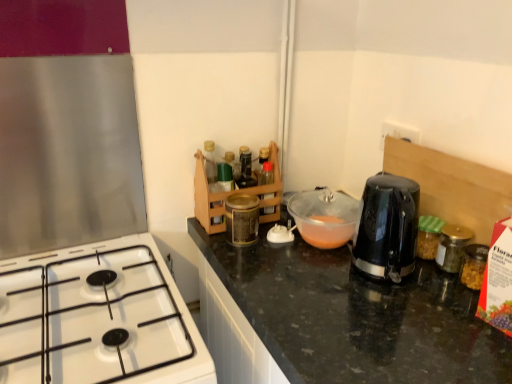
The height and width of the screenshot is (384, 512). Describe the element at coordinates (324, 217) in the screenshot. I see `translucent plastic bowl at center` at that location.

At what (x,y) coordinates should I click in order to perform the action: click on translucent plastic bowl at center. Please return your answer as a coordinate pair (x, y). This screenshot has width=512, height=384. Looking at the image, I should click on (324, 217).

Which object is closer to the camera taking this photo, gold metallic jar at right or translucent plastic bowl at center?

gold metallic jar at right is more forward.

Is gold metallic jar at right touching translucent plastic bowl at center?

No, gold metallic jar at right is not with translucent plastic bowl at center.

Does point (451, 243) come farther from viewer compared to point (287, 209)?

No, it is in front of (287, 209).

From the picture: From the image's perspective, is gold metallic jar at right on translucent plastic bowl at center?

No, from the image's perspective, gold metallic jar at right is not over translucent plastic bowl at center.

Is translucent plastic bowl at center not close to gold metallic jar at right?

No, there isn't a large distance between translucent plastic bowl at center and gold metallic jar at right.

Is translucent plastic bowl at center shorter than gold metallic jar at right?

In fact, translucent plastic bowl at center may be taller than gold metallic jar at right.

Is translucent plastic bowl at center closer to the viewer compared to gold metallic jar at right?

No, translucent plastic bowl at center is behind gold metallic jar at right.

Is translucent plastic bowl at center inside or outside of gold metallic jar at right?

translucent plastic bowl at center is located beyond the bounds of gold metallic jar at right.

From the image's perspective, which is below, white glossy gas stove at lower left or translucent plastic bowl at center?

white glossy gas stove at lower left, from the image's perspective.

Can you confirm if white glossy gas stove at lower left is wider than translucent plastic bowl at center?

Indeed, white glossy gas stove at lower left has a greater width compared to translucent plastic bowl at center.

Where is `bowl above the white glossy gas stove at lower left (from the image's perspective)`? This screenshot has width=512, height=384. bowl above the white glossy gas stove at lower left (from the image's perspective) is located at coordinates (324, 217).

Does point (147, 293) come in front of point (311, 210)?

Yes, point (147, 293) is closer to viewer.

From a real-world perspective, which is physically below, gold metallic jar at right or white glossy gas stove at lower left?

white glossy gas stove at lower left is physically lower.

Can you confirm if gold metallic jar at right is shorter than white glossy gas stove at lower left?

Answer: Correct, gold metallic jar at right is not as tall as white glossy gas stove at lower left.

From the image's perspective, is gold metallic jar at right over white glossy gas stove at lower left?

Result: Yes, from the image's perspective, gold metallic jar at right is above white glossy gas stove at lower left.

Is gold metallic jar at right far from white glossy gas stove at lower left?

gold metallic jar at right is near white glossy gas stove at lower left, not far away.

Is white glossy gas stove at lower left not close to gold metallic jar at right?

No, white glossy gas stove at lower left is in close proximity to gold metallic jar at right.

Which object is thinner, white glossy gas stove at lower left or gold metallic jar at right?

gold metallic jar at right is thinner.

Is white glossy gas stove at lower left facing away from gold metallic jar at right?

No, white glossy gas stove at lower left is not facing away from gold metallic jar at right.

Between point (35, 255) and point (453, 258), which one is positioned behind?

Point (35, 255)

In terms of width, does translucent plastic bowl at center look wider or thinner when compared to white glossy gas stove at lower left?

Considering their sizes, translucent plastic bowl at center looks slimmer than white glossy gas stove at lower left.

Where is `gas stove below the translucent plastic bowl at center (from the image's perspective)`? This screenshot has height=384, width=512. gas stove below the translucent plastic bowl at center (from the image's perspective) is located at coordinates (97, 318).

Considering the positions of point (340, 207) and point (87, 379), is point (340, 207) closer or farther from the camera than point (87, 379)?

Point (340, 207).

Is translucent plastic bowl at center at the left side of white glossy gas stove at lower left?

No, translucent plastic bowl at center is not to the left of white glossy gas stove at lower left.

You are a GUI agent. You are given a task and a screenshot of the screen. Output one action in this format:
    pyautogui.click(x=<x>, y=<y>)
    Task: Click on the bottle that is in front of the translucent plastic bowl at center
    The image size is (512, 384).
    Given the screenshot: What is the action you would take?
    pyautogui.click(x=452, y=247)

Where is `bottle below the translucent plastic bowl at center (from the image's perspective)`? The height and width of the screenshot is (384, 512). bottle below the translucent plastic bowl at center (from the image's perspective) is located at coordinates (x=452, y=247).

Looking at this image, from the image, which object appears to be farther from translucent plastic bowl at center, white glossy gas stove at lower left or gold metallic jar at right?

Among the two, white glossy gas stove at lower left is located further to translucent plastic bowl at center.

Considering their positions, is white glossy gas stove at lower left positioned further to gold metallic jar at right than translucent plastic bowl at center?

white glossy gas stove at lower left.

Estimate the real-world distances between objects in this image. Which object is further from translucent plastic bowl at center, gold metallic jar at right or white glossy gas stove at lower left?

white glossy gas stove at lower left lies further to translucent plastic bowl at center than the other object.

Looking at the image, which one is located further to white glossy gas stove at lower left, translucent plastic bowl at center or gold metallic jar at right?

gold metallic jar at right is positioned further to the anchor white glossy gas stove at lower left.

When comparing their distances from gold metallic jar at right, does translucent plastic bowl at center or white glossy gas stove at lower left seem further?

Among the two, white glossy gas stove at lower left is located further to gold metallic jar at right.

Which object lies further to the anchor point white glossy gas stove at lower left, gold metallic jar at right or translucent plastic bowl at center?

gold metallic jar at right is further to white glossy gas stove at lower left.

This screenshot has height=384, width=512. Find the location of `bowl between white glossy gas stove at lower left and gold metallic jar at right in the horizontal direction`. bowl between white glossy gas stove at lower left and gold metallic jar at right in the horizontal direction is located at coordinates (324, 217).